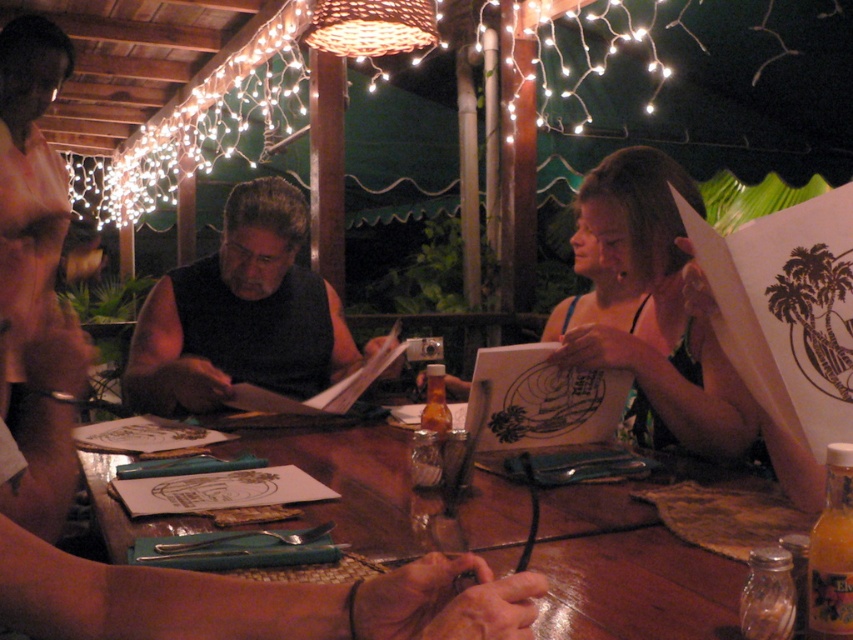
Does wooden table at center appear over black matte shirt at center?

No.

Between wooden table at center and black matte shirt at center, which one has less height?

With less height is wooden table at center.

Does point (643, 614) come closer to viewer compared to point (289, 394)?

Yes.

Where is `wooden table at center`? Image resolution: width=853 pixels, height=640 pixels. wooden table at center is located at coordinates (628, 570).

Which is more to the left, wooden table at center or matte green bikini top at upper right?

Positioned to the left is wooden table at center.

Who is taller, wooden table at center or matte green bikini top at upper right?

Standing taller between the two is matte green bikini top at upper right.

You are a GUI agent. You are given a task and a screenshot of the screen. Output one action in this format:
    pyautogui.click(x=<x>, y=<y>)
    Task: Click on the wooden table at center
    This screenshot has height=640, width=853.
    Given the screenshot: What is the action you would take?
    pyautogui.click(x=628, y=570)

Consider the image. Is black matte shirt at center below matte green bikini top at upper right?

Yes, black matte shirt at center is below matte green bikini top at upper right.

Is point (236, 285) closer to camera compared to point (577, 362)?

No, it is behind (577, 362).

Where is `black matte shirt at center`? The width and height of the screenshot is (853, 640). black matte shirt at center is located at coordinates (241, 314).